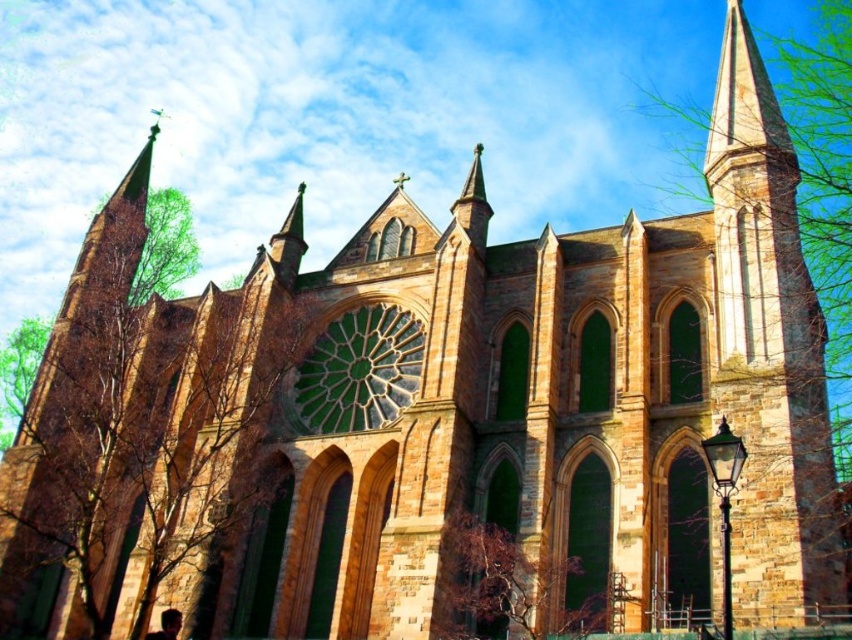
You are standing in front of the Gothic church and want to walk from the green leafy tree at left to the brown textured tree at lower center. Which direction should you move relative to the church?

You should move towards the brown textured tree at lower center, which is behind the green leafy tree at left since the green leafy tree is closer to you.

You are standing in front of the grand Gothic church and want to take a photo of the green leafy tree at left. Where should you position yourself to capture it in the frame?

The green leafy tree at left is located at point (x=140, y=419), so you should position yourself to the left side of the scene to capture it in the frame.

You are standing in front of the Gothic church and notice two trees nearby. The green leafy tree at left and the brown textured tree at lower center. Which tree do you see as taller from your current position?

The green leafy tree at left is taller than the brown textured tree at lower center, so you would perceive the green leafy tree at left as taller from your current position.